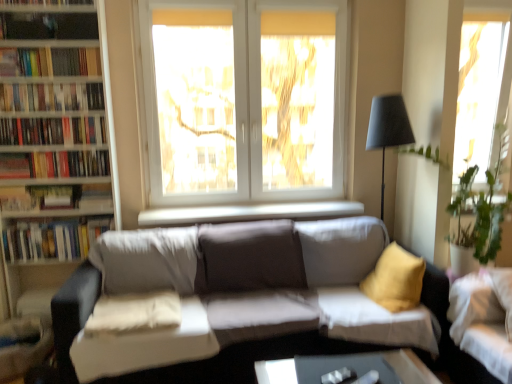
Question: From the image's perspective, does transparent glass window at upper right, the first window when ordered from right to left, appear higher than hardcover books at left, which is the fourth book from top to bottom?

Choices:
 (A) yes
 (B) no

Answer: (A)

Question: Considering the relative positions of transparent glass window at upper right, positioned as the second window in left-to-right order, and hardcover books at left, positioned as the second book in bottom-to-top order, in the image provided, is transparent glass window at upper right, positioned as the second window in left-to-right order, to the left of hardcover books at left, positioned as the second book in bottom-to-top order, from the viewer's perspective?

Choices:
 (A) yes
 (B) no

Answer: (B)

Question: Does transparent glass window at upper right, the first window when ordered from right to left, have a greater height compared to hardcover books at left, positioned as the second book in bottom-to-top order?

Choices:
 (A) no
 (B) yes

Answer: (B)

Question: From a real-world perspective, is transparent glass window at upper right, the first window when ordered from right to left, physically above hardcover books at left, which is the fourth book from top to bottom?

Choices:
 (A) no
 (B) yes

Answer: (B)

Question: Would you say transparent glass window at upper right, the first window when ordered from right to left, is outside hardcover books at left, which is the fourth book from top to bottom?

Choices:
 (A) no
 (B) yes

Answer: (B)

Question: Considering the relative sizes of transparent glass window at upper right, positioned as the second window in left-to-right order, and hardcover books at left, which is the fourth book from top to bottom, in the image provided, is transparent glass window at upper right, positioned as the second window in left-to-right order, wider than hardcover books at left, which is the fourth book from top to bottom,?

Choices:
 (A) no
 (B) yes

Answer: (B)

Question: Considering the relative positions of white smooth window sill at center and wooden bookshelf at upper left in the image provided, is white smooth window sill at center to the left of wooden bookshelf at upper left from the viewer's perspective?

Choices:
 (A) yes
 (B) no

Answer: (B)

Question: Is white smooth window sill at center taller than wooden bookshelf at upper left?

Choices:
 (A) no
 (B) yes

Answer: (A)

Question: Considering the relative sizes of white smooth window sill at center and wooden bookshelf at upper left in the image provided, is white smooth window sill at center wider than wooden bookshelf at upper left?

Choices:
 (A) no
 (B) yes

Answer: (B)

Question: From the image's perspective, would you say white smooth window sill at center is positioned over wooden bookshelf at upper left?

Choices:
 (A) no
 (B) yes

Answer: (A)

Question: From the image's perspective, is white smooth window sill at center below wooden bookshelf at upper left?

Choices:
 (A) yes
 (B) no

Answer: (A)

Question: Are white smooth window sill at center and wooden bookshelf at upper left beside each other?

Choices:
 (A) yes
 (B) no

Answer: (B)

Question: Does hardcover books at upper left, the fifth book from the bottom, have a greater width compared to white soft pillow at center?

Choices:
 (A) yes
 (B) no

Answer: (B)